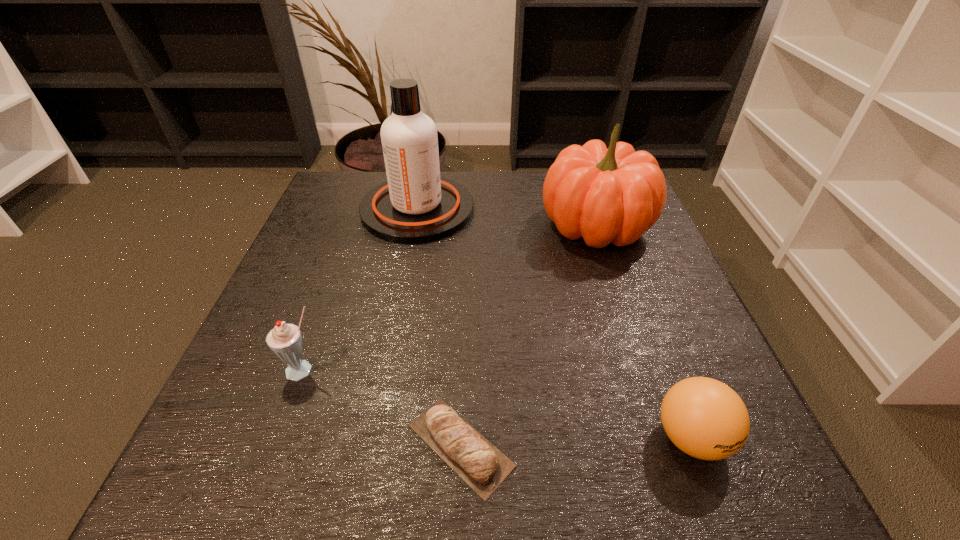
The image size is (960, 540). In order to click on object at the near right corner in this screenshot , I will do point(706,419).

You are a GUI agent. You are given a task and a screenshot of the screen. Output one action in this format:
    pyautogui.click(x=<x>, y=<y>)
    Task: Click on the vacant space at the far edge of the desktop
    The width and height of the screenshot is (960, 540).
    Given the screenshot: What is the action you would take?
    pyautogui.click(x=476, y=197)

Find the location of a particular element. The image size is (960, 540). vacant space at the left edge of the desktop is located at coordinates (311, 388).

In the image, there is a desktop. Identify the location of blank space at the right edge. (636, 316).

Identify the location of vacant space at the far left corner. (352, 172).

In the image, there is a desktop. Where is `vacant space at the near left corner`? The height and width of the screenshot is (540, 960). vacant space at the near left corner is located at coordinates (218, 494).

What are the coordinates of `vacant space at the near right corner of the desktop` in the screenshot? It's located at (694, 489).

Find the location of a particular element. The width and height of the screenshot is (960, 540). free spot between the cleansing agent and the ping-pong ball is located at coordinates (554, 323).

Locate an element on the screen. vacant area that lies between the cleansing agent and the third farthest object is located at coordinates (361, 290).

In order to click on vacant point located between the shortest object and the tallest object in this screenshot , I will do `click(439, 327)`.